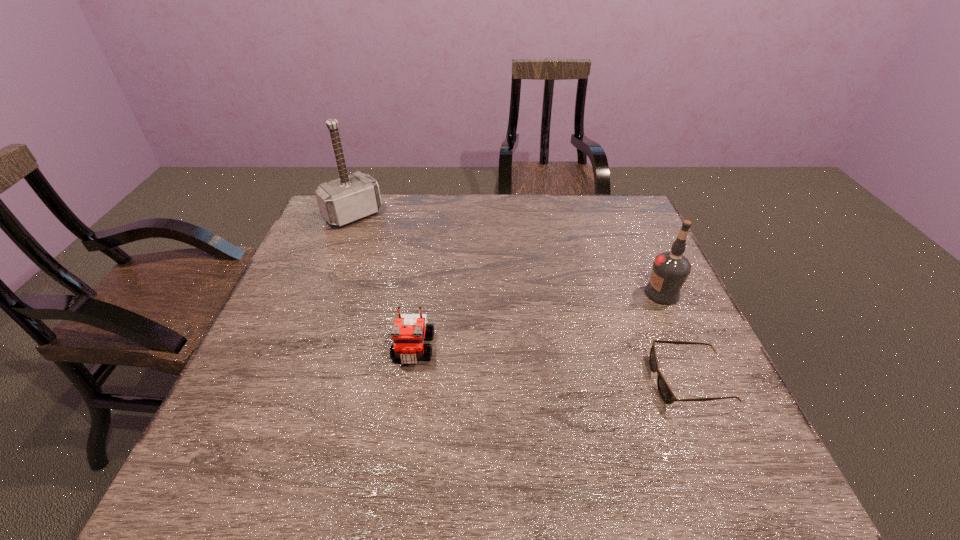
What are the coordinates of `sunglasses present at the right edge` in the screenshot? It's located at click(x=665, y=392).

At what (x,y) coordinates should I click in order to perform the action: click on vodka that is at the right edge. Please return your answer as a coordinate pair (x, y). The width and height of the screenshot is (960, 540). Looking at the image, I should click on (670, 270).

Locate an element on the screen. object present at the far left corner is located at coordinates (349, 198).

At what (x,y) coordinates should I click in order to perform the action: click on object that is positioned at the near right corner. Please return your answer as a coordinate pair (x, y). Looking at the image, I should click on (665, 392).

Where is `vacant space at the far edge of the desktop`? Image resolution: width=960 pixels, height=540 pixels. vacant space at the far edge of the desktop is located at coordinates (534, 231).

You are a GUI agent. You are given a task and a screenshot of the screen. Output one action in this format:
    pyautogui.click(x=<x>, y=<y>)
    Task: Click on the blank space at the near edge of the desktop
    
    Given the screenshot: What is the action you would take?
    pyautogui.click(x=435, y=406)

Where is `vacant space at the left edge`? This screenshot has width=960, height=540. vacant space at the left edge is located at coordinates (275, 328).

I want to click on free space at the right edge, so click(x=643, y=285).

At what (x,y) coordinates should I click in order to perform the action: click on free spot at the far right corner of the desktop. Please return your answer as a coordinate pair (x, y). Looking at the image, I should click on (593, 202).

At what (x,y) coordinates should I click in order to perform the action: click on blank space at the near right corner. Please return your answer as a coordinate pair (x, y). The image size is (960, 540). Looking at the image, I should click on (736, 433).